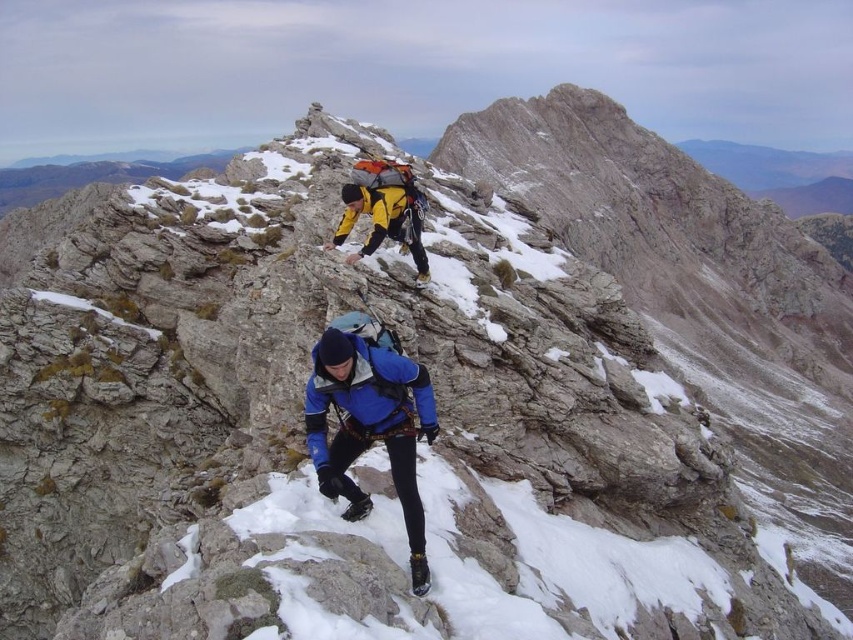
Question: In this image, where is blue fabric jacket at lower center located relative to yellow matte jacket at center?

Choices:
 (A) below
 (B) above

Answer: (A)

Question: Can you confirm if blue fabric jacket at lower center is positioned to the left of yellow matte jacket at center?

Choices:
 (A) no
 (B) yes

Answer: (A)

Question: Does blue fabric jacket at lower center appear under yellow matte jacket at center?

Choices:
 (A) yes
 (B) no

Answer: (A)

Question: Which of the following is the farthest from the observer?

Choices:
 (A) (352, 422)
 (B) (360, 166)

Answer: (B)